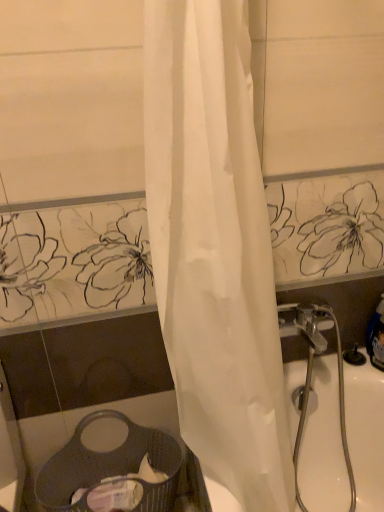
The width and height of the screenshot is (384, 512). What do you see at coordinates (342, 439) in the screenshot?
I see `white ceramic sink at lower right` at bounding box center [342, 439].

The width and height of the screenshot is (384, 512). What are the coordinates of `white ceramic sink at lower right` in the screenshot? It's located at (342, 439).

At what (x,y) coordinates should I click in order to perform the action: click on white ceramic sink at lower right. Please return your answer as a coordinate pair (x, y). The height and width of the screenshot is (512, 384). Looking at the image, I should click on (342, 439).